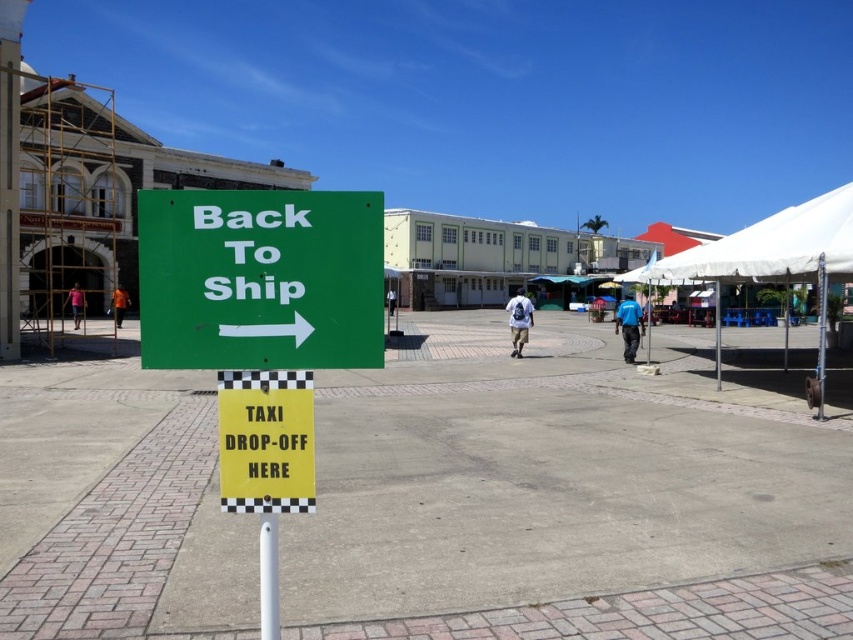
Question: Does blue fabric shirt at center appear under black fabric person at center?

Choices:
 (A) no
 (B) yes

Answer: (B)

Question: Estimate the real-world distances between objects in this image. Which object is closer to the orange shirt at left?

Choices:
 (A) blue fabric shirt at center
 (B) pink fabric at left
 (C) white fabric canopy at upper right

Answer: (B)

Question: Which object appears closest to the camera in this image?

Choices:
 (A) white plastic pole at center
 (B) white fabric canopy at upper right
 (C) green matte sign at center
 (D) pink fabric at left

Answer: (C)

Question: Is metallic pole at center wider than black fabric person at center?

Choices:
 (A) no
 (B) yes

Answer: (B)

Question: Can you confirm if green matte sign at center is positioned to the right of orange shirt at left?

Choices:
 (A) no
 (B) yes

Answer: (B)

Question: Which of the following is the closest to the observer?

Choices:
 (A) (392, 308)
 (B) (793, 234)
 (C) (83, 301)

Answer: (B)